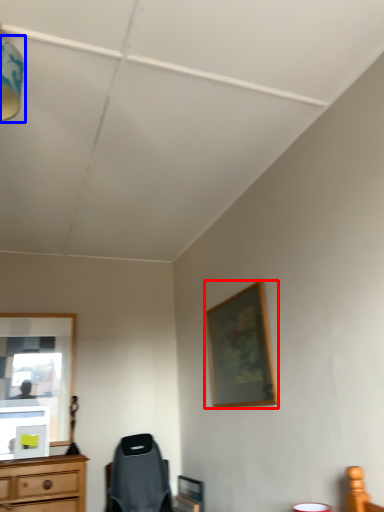
Question: Which point is closer to the camera, picture frame (highlighted by a red box) or light fixture (highlighted by a blue box)?

Choices:
 (A) picture frame
 (B) light fixture

Answer: (B)